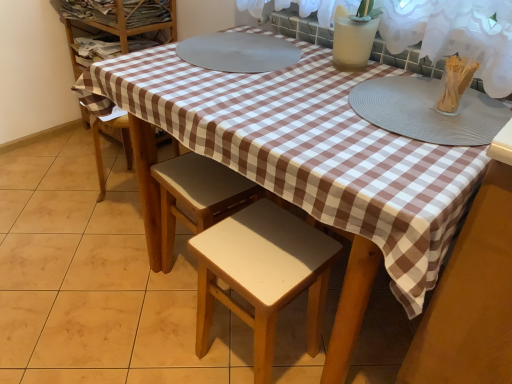
Question: Is gray textured placemat at upper right bigger than white matte glass vase at upper right?

Choices:
 (A) no
 (B) yes

Answer: (B)

Question: Are gray textured placemat at upper right and white matte glass vase at upper right beside each other?

Choices:
 (A) yes
 (B) no

Answer: (B)

Question: Is gray textured placemat at upper right smaller than white matte glass vase at upper right?

Choices:
 (A) no
 (B) yes

Answer: (A)

Question: Is gray textured placemat at upper right thinner than white matte glass vase at upper right?

Choices:
 (A) yes
 (B) no

Answer: (B)

Question: Does gray textured placemat at upper right contain white matte glass vase at upper right?

Choices:
 (A) no
 (B) yes

Answer: (A)

Question: Considering their positions, is clear plastic container at upper right located in front of or behind white matte glass vase at upper right?

Choices:
 (A) front
 (B) behind

Answer: (A)

Question: Do you think clear plastic container at upper right is within white matte glass vase at upper right, or outside of it?

Choices:
 (A) inside
 (B) outside

Answer: (B)

Question: From a real-world perspective, relative to white matte glass vase at upper right, is clear plastic container at upper right vertically above or below?

Choices:
 (A) above
 (B) below

Answer: (B)

Question: Considering the positions of point (475, 64) and point (351, 39), is point (475, 64) closer or farther from the camera than point (351, 39)?

Choices:
 (A) closer
 (B) farther

Answer: (A)

Question: Does point (343, 64) appear closer or farther from the camera than point (207, 195)?

Choices:
 (A) farther
 (B) closer

Answer: (A)

Question: Considering the relative positions of white matte glass vase at upper right and light brown wood stool at center, marked as the 2th stool in a front-to-back arrangement, in the image provided, is white matte glass vase at upper right to the left or to the right of light brown wood stool at center, marked as the 2th stool in a front-to-back arrangement,?

Choices:
 (A) left
 (B) right

Answer: (B)

Question: Choose the correct answer: Is white matte glass vase at upper right inside light brown wood stool at center, which ranks as the 1th stool in back-to-front order, or outside it?

Choices:
 (A) inside
 (B) outside

Answer: (B)

Question: From their relative heights in the image, would you say white matte glass vase at upper right is taller or shorter than light brown wood stool at center, which ranks as the 1th stool in back-to-front order?

Choices:
 (A) tall
 (B) short

Answer: (B)

Question: In the image, is gray textured placemat at upper right on the left side or the right side of light brown wood stool at center, which ranks as the 1th stool in back-to-front order?

Choices:
 (A) right
 (B) left

Answer: (A)

Question: From a real-world perspective, is gray textured placemat at upper right physically located above or below light brown wood stool at center, which ranks as the 1th stool in back-to-front order?

Choices:
 (A) above
 (B) below

Answer: (A)